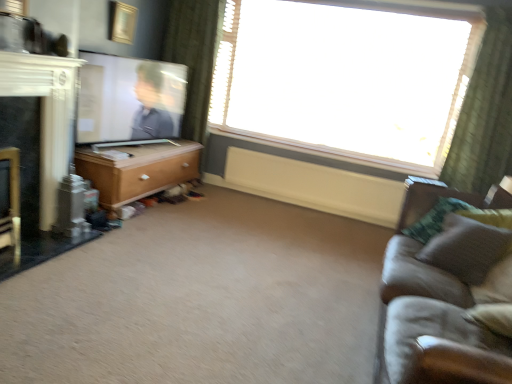
This screenshot has width=512, height=384. What do you see at coordinates (466, 248) in the screenshot? I see `green textured pillow at right` at bounding box center [466, 248].

Where is `green textured curtain at upper right`? green textured curtain at upper right is located at coordinates click(485, 113).

Where is `matte white tv at left`? This screenshot has height=384, width=512. matte white tv at left is located at coordinates (128, 99).

Locate an element on the screen. Image resolution: width=512 pixels, height=384 pixels. wooden chest of drawers at left is located at coordinates (138, 170).

From their relative heights in the image, would you say wooden chest of drawers at left is taller or shorter than green textured pillow at right?

In the image, wooden chest of drawers at left appears to be taller than green textured pillow at right.

Who is bigger, wooden chest of drawers at left or green textured pillow at right?

Bigger between the two is wooden chest of drawers at left.

How many degrees apart are the facing directions of wooden chest of drawers at left and green textured pillow at right?

The facing directions of wooden chest of drawers at left and green textured pillow at right are 123 degrees apart.

Is wooden chest of drawers at left aimed at green textured pillow at right?

Yes, wooden chest of drawers at left is oriented towards green textured pillow at right.

From the image's perspective, does gold metallic picture frame at upper center appear higher than wooden chest of drawers at left?

Yes.

Locate an element on the screen. The width and height of the screenshot is (512, 384). the chest of drawers that appears below the gold metallic picture frame at upper center (from the image's perspective) is located at coordinates (138, 170).

Considering the relative sizes of gold metallic picture frame at upper center and wooden chest of drawers at left in the image provided, is gold metallic picture frame at upper center taller than wooden chest of drawers at left?

In fact, gold metallic picture frame at upper center may be shorter than wooden chest of drawers at left.

In the image, is green textured curtain at upper right on the left side or the right side of wooden chest of drawers at left?

In the image, green textured curtain at upper right appears on the right side of wooden chest of drawers at left.

Is point (499, 67) positioned after point (88, 161)?

Yes, it is.

Which of these two, green textured curtain at upper right or wooden chest of drawers at left, is bigger?

Bigger between the two is wooden chest of drawers at left.

From the image's perspective, which one is positioned lower, green textured curtain at upper right or wooden chest of drawers at left?

wooden chest of drawers at left.

From the image's perspective, is matte white tv at left above gold metallic picture frame at upper center?

No, from the image's perspective, matte white tv at left is not over gold metallic picture frame at upper center.

Is matte white tv at left taller or shorter than gold metallic picture frame at upper center?

matte white tv at left is taller than gold metallic picture frame at upper center.

This screenshot has width=512, height=384. Find the location of `window screen lying on the right of gold metallic picture frame at upper center`. window screen lying on the right of gold metallic picture frame at upper center is located at coordinates (128, 99).

Is point (149, 130) positioned before point (122, 34)?

That is False.

Is transparent glass window at upper center facing towards matte white tv at left?

Yes, transparent glass window at upper center is facing matte white tv at left.

From a real-world perspective, which is physically below, transparent glass window at upper center or matte white tv at left?

From a 3D spatial view, matte white tv at left is below.

Can you confirm if transparent glass window at upper center is smaller than matte white tv at left?

Incorrect, transparent glass window at upper center is not smaller in size than matte white tv at left.

Image resolution: width=512 pixels, height=384 pixels. Identify the location of window located above the matte white tv at left (from the image's perspective). (346, 78).

From a real-world perspective, is wooden chest of drawers at left located higher than matte white tv at left?

Incorrect, from a real-world perspective, wooden chest of drawers at left is lower than matte white tv at left.

Does wooden chest of drawers at left come behind matte white tv at left?

Yes, wooden chest of drawers at left is behind matte white tv at left.

Does point (159, 154) appear closer or farther from the camera than point (123, 112)?

Point (159, 154) is farther from the camera than point (123, 112).

Between wooden chest of drawers at left and matte white tv at left, which one appears on the right side from the viewer's perspective?

matte white tv at left.

From the image's perspective, is transparent glass window at upper center below carpet at center?

No, from the image's perspective, transparent glass window at upper center is not beneath carpet at center.

Is transparent glass window at upper center located outside carpet at center?

Yes, transparent glass window at upper center is located beyond the bounds of carpet at center.

Is transparent glass window at upper center touching carpet at center?

transparent glass window at upper center and carpet at center are clearly separated.

Considering the sizes of transparent glass window at upper center and carpet at center in the image, is transparent glass window at upper center bigger or smaller than carpet at center?

transparent glass window at upper center is bigger than carpet at center.

Locate an element on the screen. This screenshot has height=384, width=512. chest of drawers below the green textured pillow at right (from a real-world perspective) is located at coordinates (138, 170).

The image size is (512, 384). What are the coordinates of `picture frame above the wooden chest of drawers at left (from a real-world perspective)` in the screenshot? It's located at (122, 22).

Considering their positions, is green textured curtain at upper right positioned closer to suede gray couch at right than black glossy fireplace at left?

green textured curtain at upper right.

Based on their spatial positions, is suede gray couch at right or black glossy fireplace at left closer to carpet at center?

black glossy fireplace at left is positioned closer to the anchor carpet at center.

Looking at the image, which one is located further to matte white tv at left, gold metallic picture frame at upper center or green textured pillow at right?

green textured pillow at right lies further to matte white tv at left than the other object.

When comparing their distances from green textured pillow at right, does suede gray couch at right or green textured curtain at upper right seem closer?

suede gray couch at right lies closer to green textured pillow at right than the other object.

Based on their spatial positions, is wooden chest of drawers at left or suede gray couch at right closer to carpet at center?

Based on the image, suede gray couch at right appears to be nearer to carpet at center.

Estimate the real-world distances between objects in this image. Which object is closer to suede gray couch at right, gold metallic picture frame at upper center or green textured pillow at right?

green textured pillow at right lies closer to suede gray couch at right than the other object.

When comparing their distances from black glossy fireplace at left, does matte white tv at left or green textured pillow at right seem closer?

The object closer to black glossy fireplace at left is matte white tv at left.

From the image, which object appears to be nearer to wooden chest of drawers at left, black glossy fireplace at left or green textured pillow at right?

black glossy fireplace at left is closer to wooden chest of drawers at left.

You are a GUI agent. You are given a task and a screenshot of the screen. Output one action in this format:
    pyautogui.click(x=<x>, y=<y>)
    Task: Click on the pillow between suede gray couch at right and green textured curtain at upper right along the z-axis
    The width and height of the screenshot is (512, 384).
    Given the screenshot: What is the action you would take?
    pyautogui.click(x=466, y=248)

Find the location of a particular element. This screenshot has width=512, height=384. plain positioned between suede gray couch at right and gold metallic picture frame at upper center from near to far is located at coordinates (202, 299).

Locate an element on the screen. window situated between matte white tv at left and green textured curtain at upper right from left to right is located at coordinates (346, 78).

Locate an element on the screen. fireplace between carpet at center and matte white tv at left in the front-back direction is located at coordinates (36, 153).